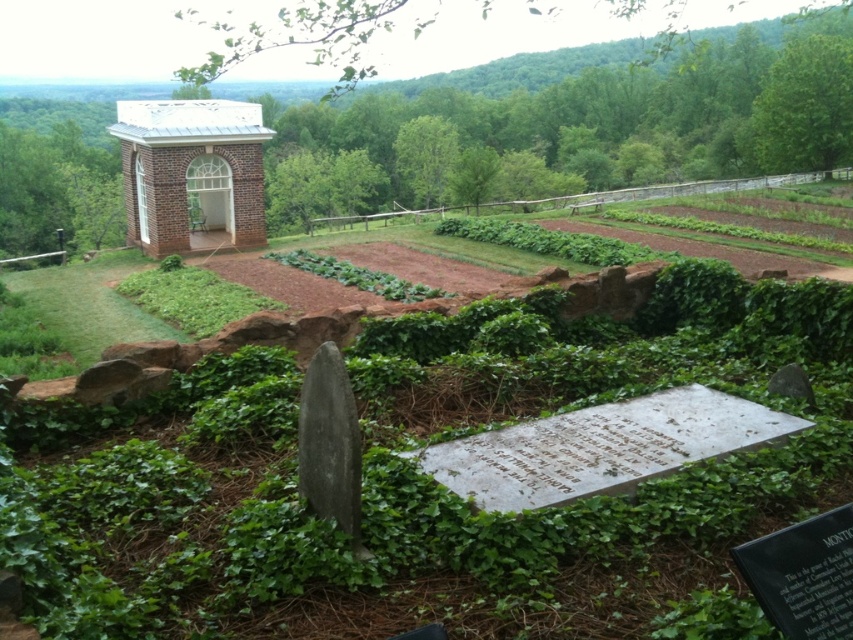
Question: Is green leafy plants at center positioned before white brick chapel at upper left?

Choices:
 (A) yes
 (B) no

Answer: (A)

Question: Is green leafy plants at center to the right of white brick chapel at upper left from the viewer's perspective?

Choices:
 (A) yes
 (B) no

Answer: (A)

Question: Which of the following is the closest to the observer?

Choices:
 (A) white brick chapel at upper left
 (B) green leafy plants at center

Answer: (B)

Question: Does green leafy plants at center appear over white brick chapel at upper left?

Choices:
 (A) no
 (B) yes

Answer: (B)

Question: Among these objects, which one is nearest to the camera?

Choices:
 (A) white brick chapel at upper left
 (B) green leafy plants at center

Answer: (B)